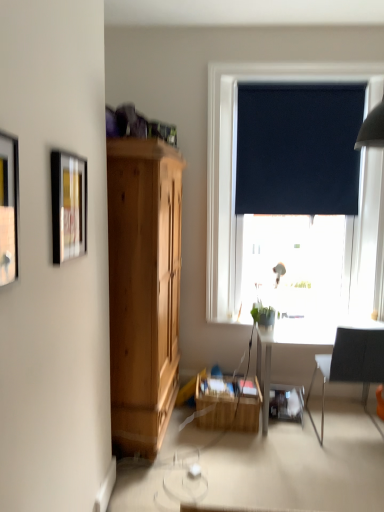
Question: Considering the relative sizes of matte black picture frame at left, positioned as the 1th picture frame in front-to-back order, and green matte plant at lower center in the image provided, is matte black picture frame at left, positioned as the 1th picture frame in front-to-back order, wider than green matte plant at lower center?

Choices:
 (A) yes
 (B) no

Answer: (B)

Question: Is green matte plant at lower center inside matte black picture frame at left, the second picture frame from the back?

Choices:
 (A) yes
 (B) no

Answer: (B)

Question: From the image's perspective, is matte black picture frame at left, positioned as the 1th picture frame in front-to-back order, located beneath green matte plant at lower center?

Choices:
 (A) no
 (B) yes

Answer: (A)

Question: Does matte black picture frame at left, positioned as the 1th picture frame in front-to-back order, have a smaller size compared to green matte plant at lower center?

Choices:
 (A) no
 (B) yes

Answer: (B)

Question: Does matte black picture frame at left, positioned as the 1th picture frame in front-to-back order, appear on the right side of green matte plant at lower center?

Choices:
 (A) yes
 (B) no

Answer: (B)

Question: From the image's perspective, is metallic silver picture frame at upper left, which is counted as the second picture frame, starting from the front, positioned above or below black fabric curtain at upper right?

Choices:
 (A) above
 (B) below

Answer: (B)

Question: Choose the correct answer: Is metallic silver picture frame at upper left, which is counted as the second picture frame, starting from the front, inside black fabric curtain at upper right or outside it?

Choices:
 (A) outside
 (B) inside

Answer: (A)

Question: From their relative heights in the image, would you say metallic silver picture frame at upper left, which is counted as the first picture frame, starting from the back, is taller or shorter than black fabric curtain at upper right?

Choices:
 (A) tall
 (B) short

Answer: (B)

Question: Is metallic silver picture frame at upper left, which is counted as the second picture frame, starting from the front, wider or thinner than black fabric curtain at upper right?

Choices:
 (A) wide
 (B) thin

Answer: (A)

Question: In the image, is green matte plant at lower center positioned in front of or behind black fabric chair at right?

Choices:
 (A) front
 (B) behind

Answer: (B)

Question: Considering the positions of green matte plant at lower center and black fabric chair at right in the image, is green matte plant at lower center wider or thinner than black fabric chair at right?

Choices:
 (A) thin
 (B) wide

Answer: (A)

Question: From a real-world perspective, is green matte plant at lower center physically located above or below black fabric chair at right?

Choices:
 (A) below
 (B) above

Answer: (B)

Question: Is point (264, 314) positioned closer to the camera than point (359, 359)?

Choices:
 (A) closer
 (B) farther

Answer: (B)

Question: Looking at their shapes, would you say black fabric curtain at upper right is wider or thinner than wooden crate at center?

Choices:
 (A) wide
 (B) thin

Answer: (B)

Question: Is point (327, 118) closer or farther from the camera than point (223, 379)?

Choices:
 (A) farther
 (B) closer

Answer: (A)